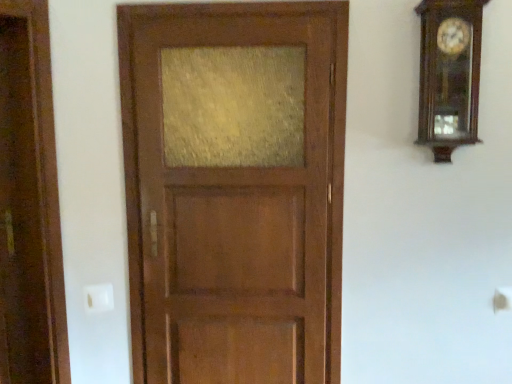
Question: Is point (209, 13) positioned closer to the camera than point (444, 84)?

Choices:
 (A) farther
 (B) closer

Answer: (A)

Question: Looking at the image, does satin wood door at center seem bigger or smaller compared to wooden grandfather clock at upper right?

Choices:
 (A) small
 (B) big

Answer: (B)

Question: In the image, is satin wood door at center on the left side or the right side of wooden grandfather clock at upper right?

Choices:
 (A) right
 (B) left

Answer: (B)

Question: Looking at their shapes, would you say wooden grandfather clock at upper right is wider or thinner than satin wood door at center?

Choices:
 (A) thin
 (B) wide

Answer: (B)

Question: Is wooden grandfather clock at upper right in front of or behind satin wood door at center in the image?

Choices:
 (A) behind
 (B) front

Answer: (B)

Question: From a real-world perspective, is wooden grandfather clock at upper right above or below satin wood door at center?

Choices:
 (A) below
 (B) above

Answer: (B)

Question: Would you say wooden grandfather clock at upper right is to the left or to the right of satin wood door at center in the picture?

Choices:
 (A) left
 (B) right

Answer: (B)